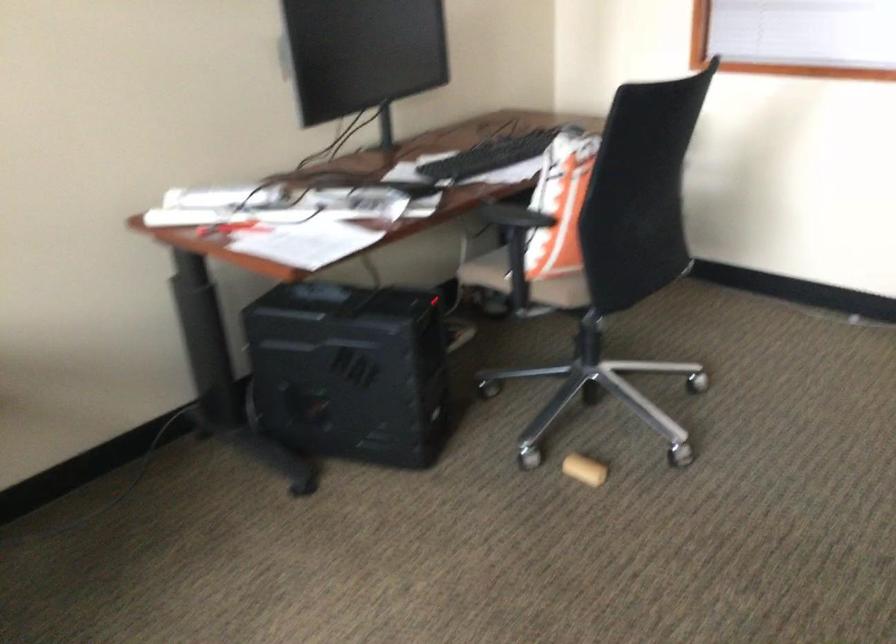
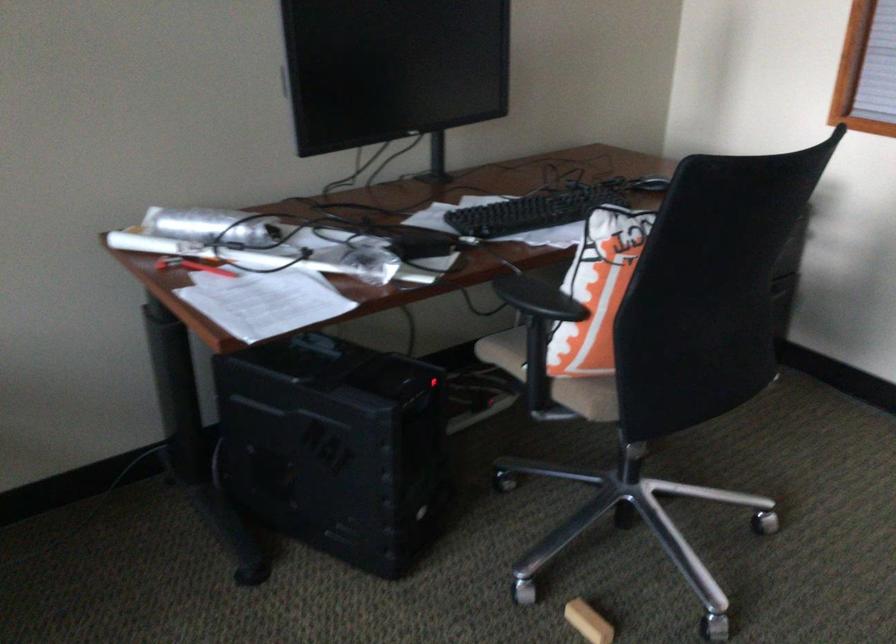
Where in the second image is the point corresponding to the point at 591,469 from the first image?

(588, 621)